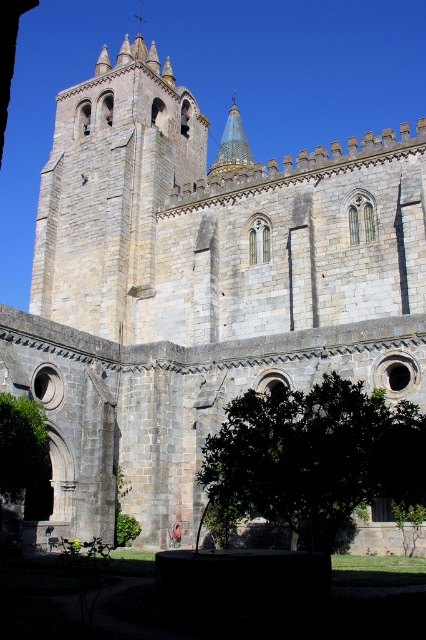
Is green leafy tree at lower center to the left of green leafy tree at lower left from the viewer's perspective?

In fact, green leafy tree at lower center is to the right of green leafy tree at lower left.

In the scene shown: Is green leafy tree at lower center smaller than green leafy tree at lower left?

Actually, green leafy tree at lower center might be larger than green leafy tree at lower left.

Measure the distance between green leafy tree at lower center and camera.

green leafy tree at lower center and camera are 113.61 feet apart.

At what (x,y) coordinates should I click in order to perform the action: click on green leafy tree at lower center. Please return your answer as a coordinate pair (x, y). The image size is (426, 640). Looking at the image, I should click on (313, 456).